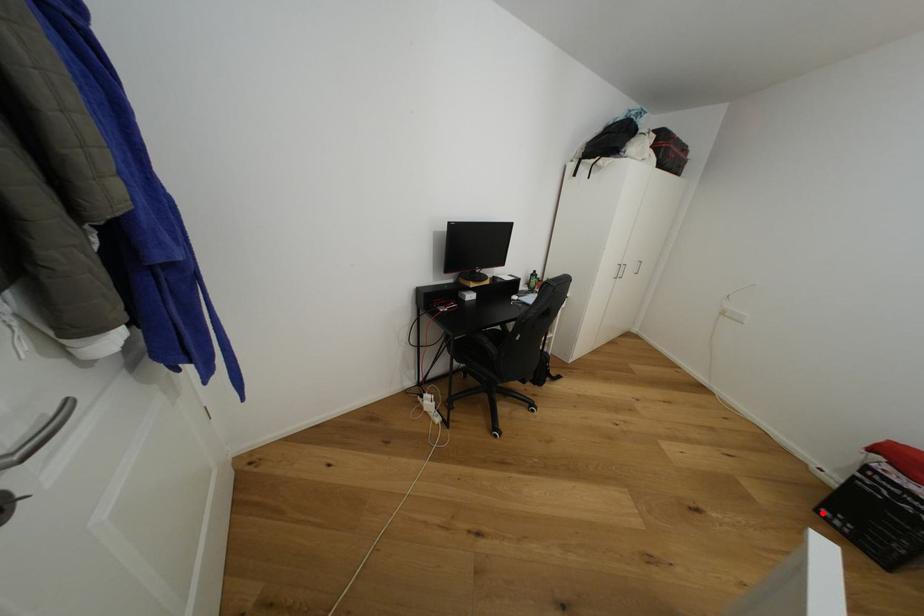
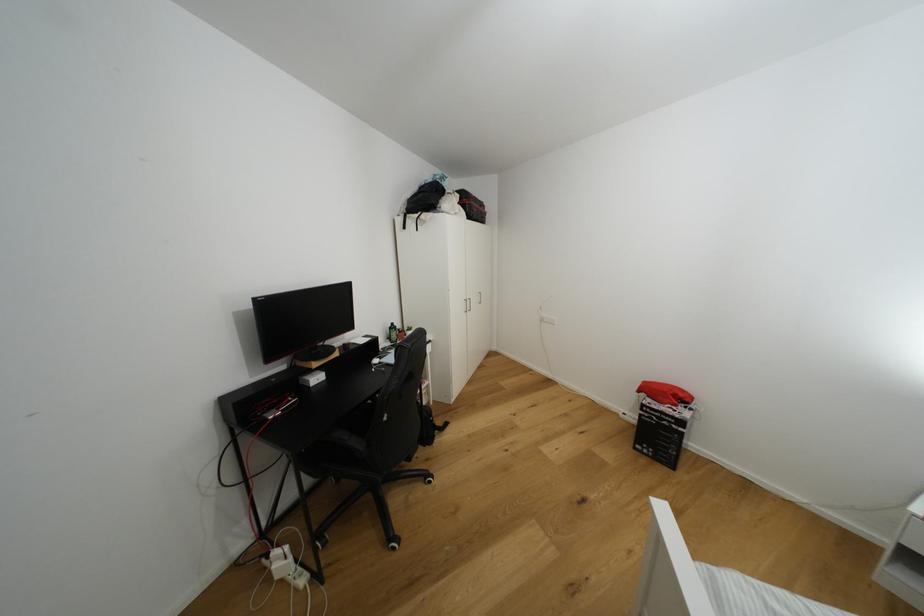
Find the pixel in the second image that matches the highlighted location in the first image.

(639, 450)